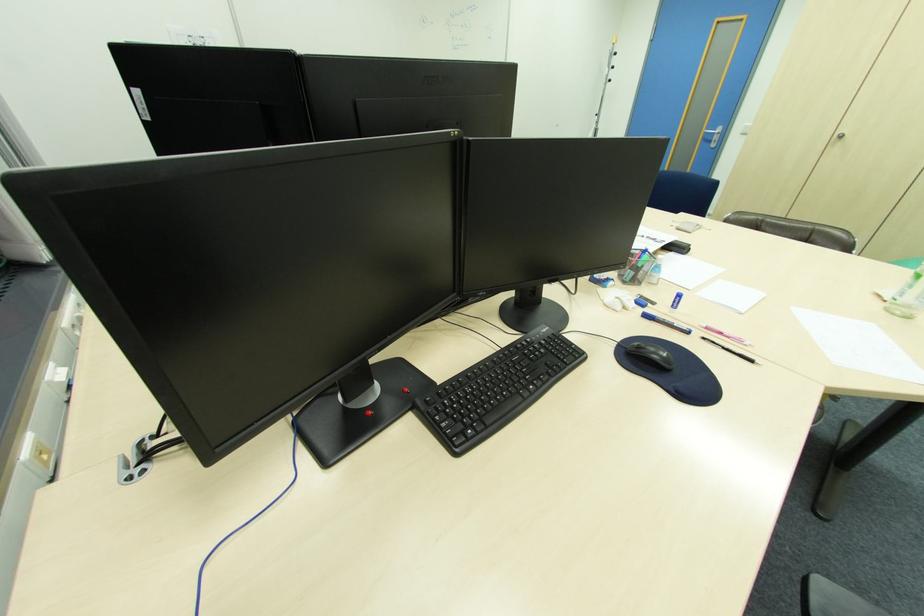
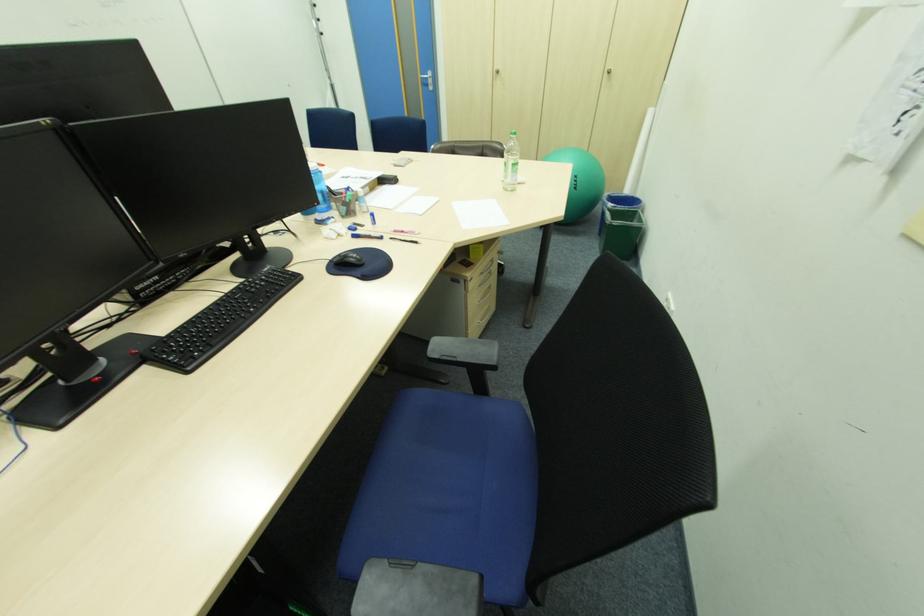
The point at (710, 134) is marked in the first image. Where is the corresponding point in the second image?

(428, 79)